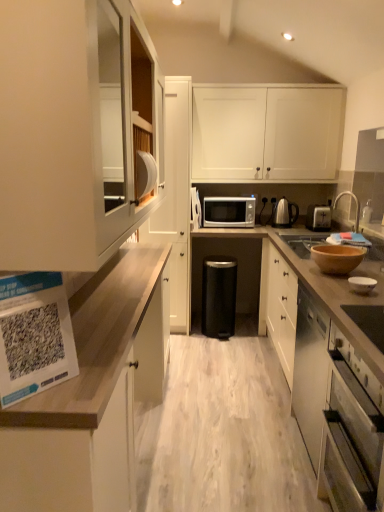
Locate an element on the screen. This screenshot has width=384, height=512. free space in front of black matte trash can at center is located at coordinates (225, 346).